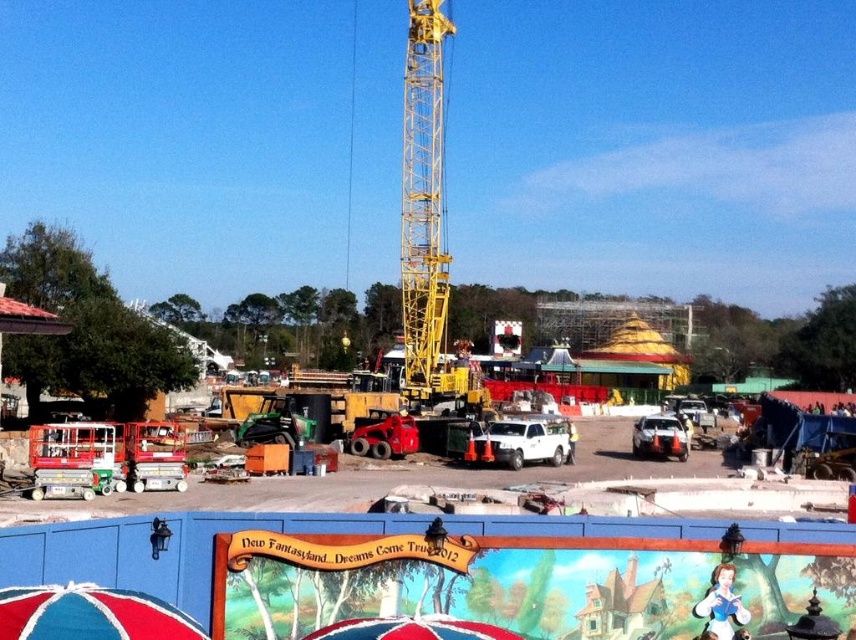
Question: Which is nearer to the red fabric umbrella at lower center?

Choices:
 (A) metallic silver car at center
 (B) white matte truck at center
 (C) yellow metallic crane at center

Answer: (B)

Question: Based on their relative distances, which object is nearer to the red fabric umbrella at lower left?

Choices:
 (A) metallic silver car at center
 (B) yellow metallic crane at center

Answer: (A)

Question: Which object appears farthest from the camera in this image?

Choices:
 (A) metallic silver car at center
 (B) white matte truck at center

Answer: (A)

Question: Is red fabric umbrella at lower left to the right of red fabric umbrella at lower center from the viewer's perspective?

Choices:
 (A) no
 (B) yes

Answer: (A)

Question: Observing the image, what is the correct spatial positioning of red fabric umbrella at lower left in reference to red fabric umbrella at lower center?

Choices:
 (A) left
 (B) right

Answer: (A)

Question: Observing the image, what is the correct spatial positioning of white matte truck at center in reference to metallic silver car at center?

Choices:
 (A) left
 (B) right

Answer: (A)